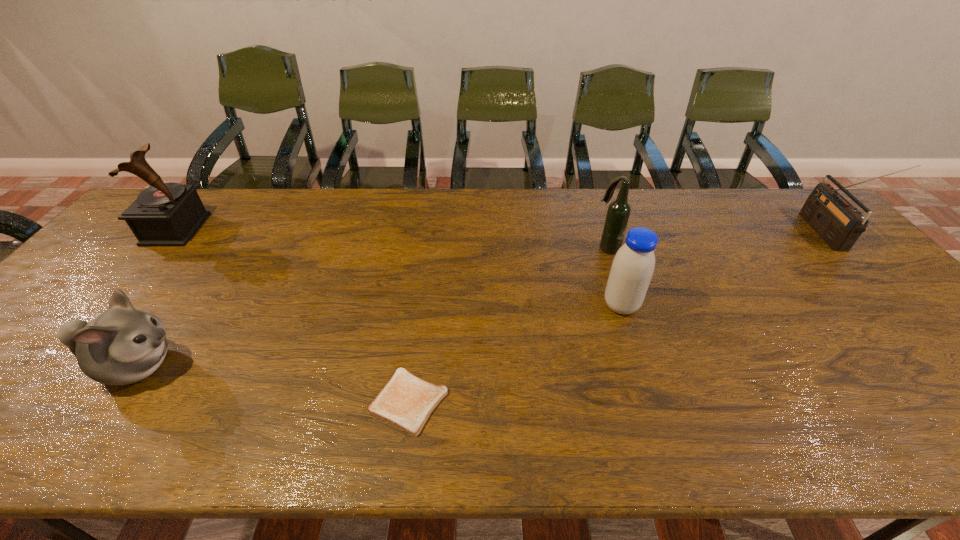
The width and height of the screenshot is (960, 540). Identify the location of free region located 0.190m at the horn opening of the phonograph_record. (259, 229).

This screenshot has height=540, width=960. Find the location of `free spot located 0.080m on the back of the beer bottle`. free spot located 0.080m on the back of the beer bottle is located at coordinates pyautogui.click(x=599, y=226).

Locate an element on the screen. vacant area located 0.260m on the right of the third nearest object is located at coordinates (739, 306).

Locate an element on the screen. vacant space located 0.340m on the face of the hamster is located at coordinates (333, 366).

Identify the location of free space located 0.220m on the left of the shortest object. This screenshot has height=540, width=960. (267, 401).

You are a GUI agent. You are given a task and a screenshot of the screen. Output one action in this format:
    pyautogui.click(x=<x>, y=<y>)
    Task: Click on the radio receiver at the far edge
    This screenshot has height=540, width=960.
    Given the screenshot: What is the action you would take?
    pyautogui.click(x=839, y=224)

You are a GUI agent. You are given a task and a screenshot of the screen. Output one action in this format:
    pyautogui.click(x=<x>, y=<y>)
    Task: Click on the phonograph_record located at the far edge
    This screenshot has height=540, width=960.
    Given the screenshot: What is the action you would take?
    pyautogui.click(x=165, y=214)

Image resolution: width=960 pixels, height=540 pixels. I want to click on object present at the near edge, so click(406, 402).

In order to click on object that is positioned at the left edge in this screenshot , I will do [x=165, y=214].

This screenshot has height=540, width=960. I want to click on object that is at the right edge, so click(x=839, y=224).